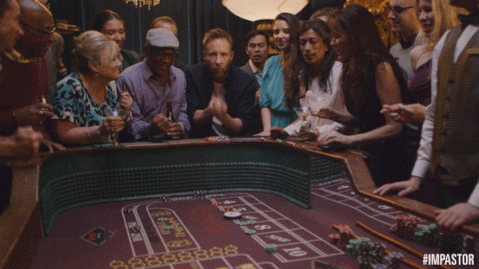
Identify the location of overhead light. This screenshot has width=479, height=269. (143, 5).